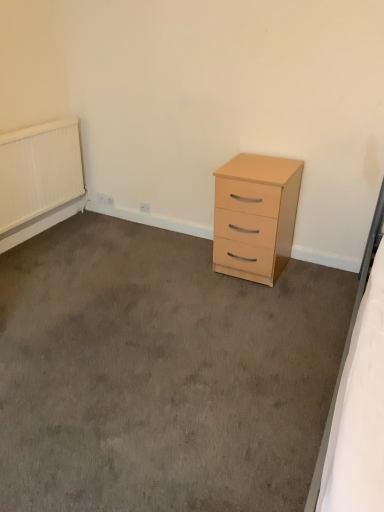
Locate an element on the screen. The image size is (384, 512). free point to the right of light wood/finish chest of drawers at center-right is located at coordinates (314, 277).